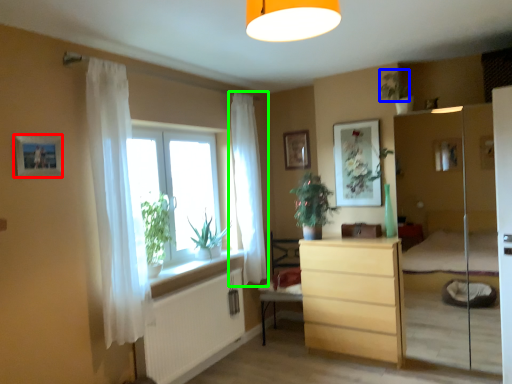
Question: Considering the real-world distances, which object is farthest from picture frame (highlighted by a red box)? plant (highlighted by a blue box) or curtain (highlighted by a green box)?

Choices:
 (A) plant
 (B) curtain

Answer: (A)